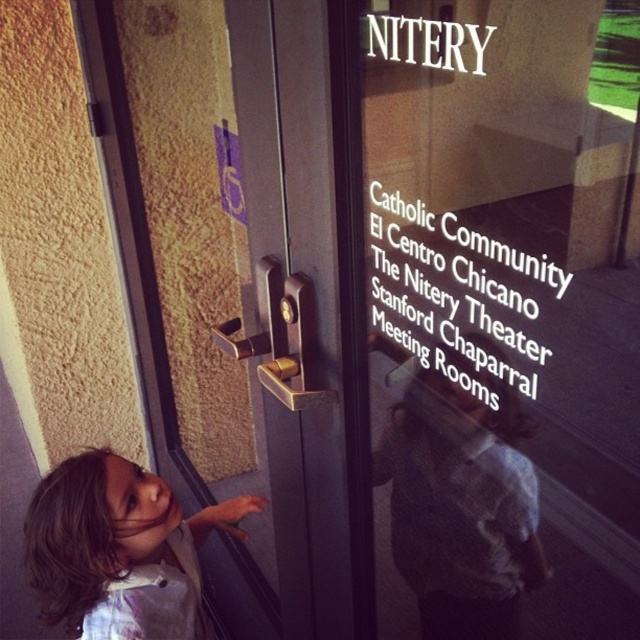
Is light brown hair at lower left to the right of brown hair at lower left from the viewer's perspective?

Indeed, light brown hair at lower left is positioned on the right side of brown hair at lower left.

Is light brown hair at lower left below brown hair at lower left?

No, light brown hair at lower left is not below brown hair at lower left.

Measure the distance between point (451,426) and camera.

The distance of point (451,426) from camera is 30.23 inches.

I want to click on light brown hair at lower left, so click(461, 500).

Between transparent glass door at center and light brown hair at lower left, which one is positioned lower?

light brown hair at lower left

Does transparent glass door at center appear under light brown hair at lower left?

Incorrect, transparent glass door at center is not positioned below light brown hair at lower left.

Is point (499, 260) farther from viewer compared to point (426, 513)?

No.

This screenshot has width=640, height=640. Identify the location of transparent glass door at center. (502, 316).

Is transparent glass door at center above brown hair at lower left?

Yes, transparent glass door at center is above brown hair at lower left.

Is transparent glass door at center positioned at the back of brown hair at lower left?

No, transparent glass door at center is closer to the viewer.

Measure the distance between point (506,621) and camera.

Point (506,621) and camera are 31.02 inches apart.

In order to click on transparent glass door at center in this screenshot , I will do `click(502, 316)`.